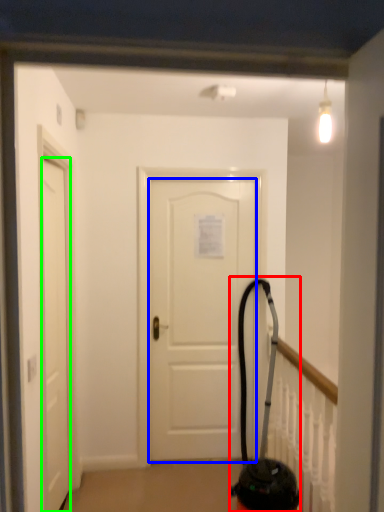
Question: Estimate the real-world distances between objects in this image. Which object is closer to extinguisher (highlighted by a red box), door (highlighted by a blue box) or door (highlighted by a green box)?

Choices:
 (A) door
 (B) door

Answer: (A)